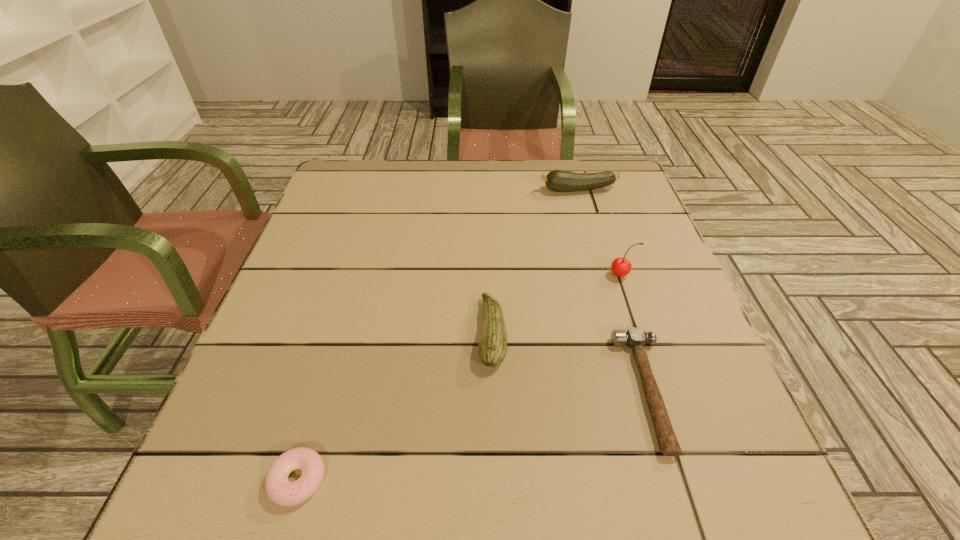
At what (x,y) coordinates should I click in order to perform the action: click on empty space that is in between the farther zucchini and the doughnut. Please return your answer as a coordinate pair (x, y). Image resolution: width=960 pixels, height=540 pixels. Looking at the image, I should click on (438, 335).

The height and width of the screenshot is (540, 960). Find the location of `empty space that is in between the right zucchini and the second object from left to right`. empty space that is in between the right zucchini and the second object from left to right is located at coordinates (535, 261).

This screenshot has width=960, height=540. Find the location of `vacant area between the right zucchini and the second farthest object`. vacant area between the right zucchini and the second farthest object is located at coordinates (600, 232).

Identify the location of free space between the farther zucchini and the leftmost object. (438, 335).

Identify the location of vacant region between the farthest object and the leftmost object. (438, 335).

Where is `the closest object to the doughnut`? the closest object to the doughnut is located at coordinates (492, 348).

The height and width of the screenshot is (540, 960). What are the coordinates of `the third closest object relative to the leftmost object` in the screenshot? It's located at tap(621, 267).

I want to click on vacant space that satisfies the following two spatial constraints: 1. at the blossom end of the right zucchini; 2. on the front side of the leftmost object, so point(662,480).

Image resolution: width=960 pixels, height=540 pixels. I want to click on free space that satisfies the following two spatial constraints: 1. on the striking face of the hammer; 2. on the front side of the doughnut, so click(x=675, y=480).

The width and height of the screenshot is (960, 540). I want to click on free space that satisfies the following two spatial constraints: 1. at the blossom end of the right zucchini; 2. on the right side of the cherry, so click(x=603, y=275).